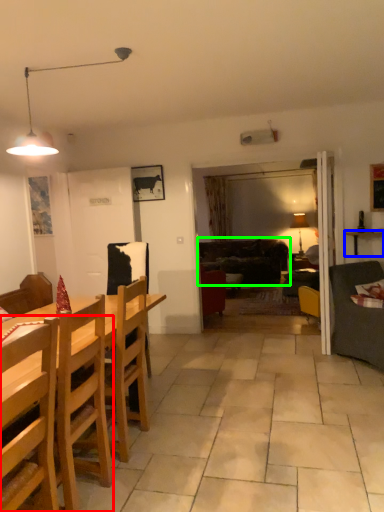
Question: Which object is positioned farthest from chair (highlighted by a red box)? Select from cabinetry (highlighted by a blue box) and studio couch (highlighted by a green box).

Choices:
 (A) cabinetry
 (B) studio couch

Answer: (B)